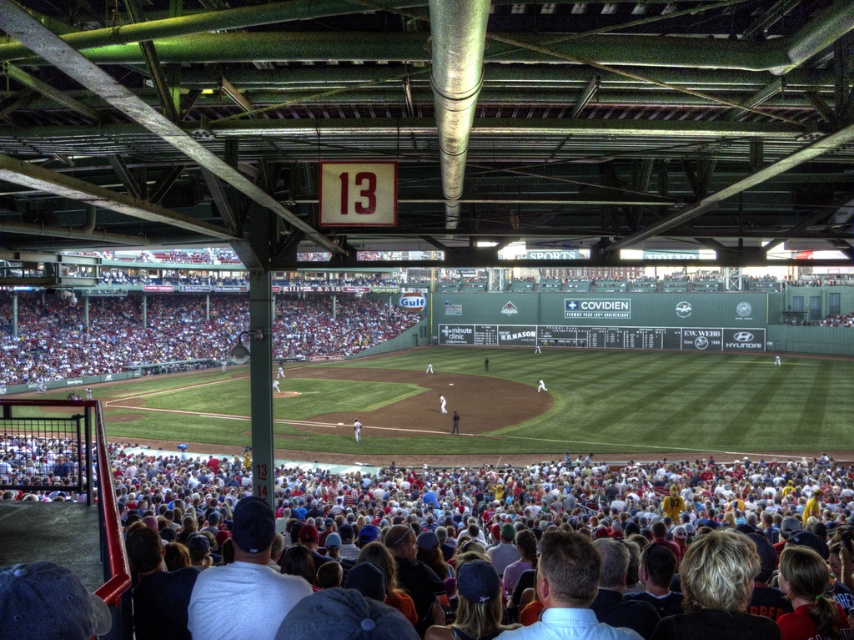
Question: Is white uniformed player at center thinner than dark brown leather jacket at center?

Choices:
 (A) yes
 (B) no

Answer: (B)

Question: Can you confirm if white jersey baseball team at lower center is positioned to the left of white uniformed player at center?

Choices:
 (A) yes
 (B) no

Answer: (B)

Question: Among these points, which one is farthest from the camera?

Choices:
 (A) (451, 417)
 (B) (442, 404)
 (C) (355, 433)
 (D) (545, 388)

Answer: (D)

Question: Which of these objects is positioned closest to the white uniformed player at center?

Choices:
 (A) white uniform at center
 (B) white fabric cap at center
 (C) dark brown leather jacket at center
 (D) white jersey baseball team at lower center

Answer: (C)

Question: In this image, where is white uniformed player at center located relative to dark brown leather jacket at center?

Choices:
 (A) left
 (B) right

Answer: (A)

Question: Which object is positioned closest to the white uniformed player at center?

Choices:
 (A) dark brown leather jacket at center
 (B) white fabric cap at center
 (C) white uniform at center
 (D) white jersey baseball team at lower center

Answer: (A)